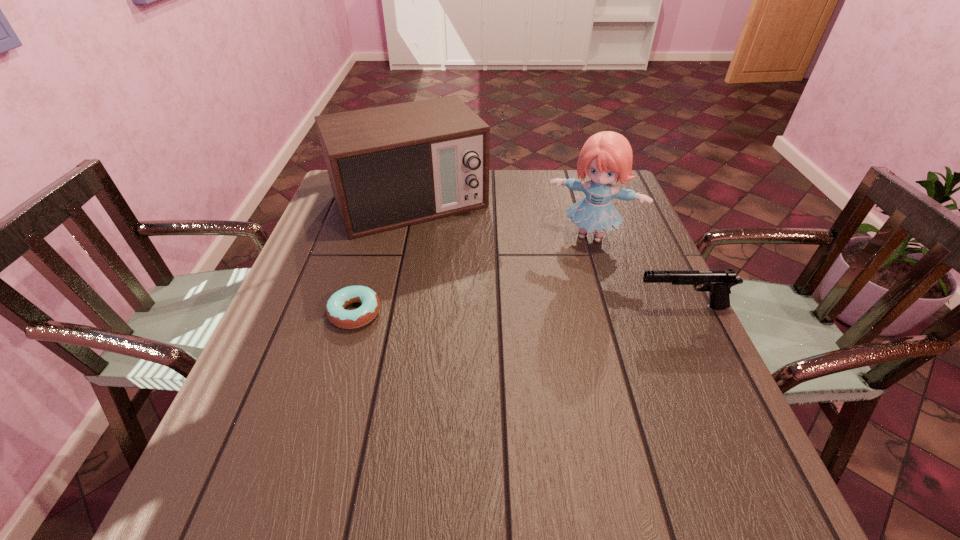
This screenshot has height=540, width=960. In order to click on vacant space at the near edge in this screenshot , I will do `click(589, 409)`.

The width and height of the screenshot is (960, 540). In the image, there is a desktop. Identify the location of free space at the left edge. (333, 275).

In the image, there is a desktop. Identify the location of blank space at the right edge. The width and height of the screenshot is (960, 540). (651, 297).

Identify the location of vacant space at the near right corner of the desktop. The height and width of the screenshot is (540, 960). (684, 421).

Where is `free space that is in between the tallest object and the shortest object`? The image size is (960, 540). free space that is in between the tallest object and the shortest object is located at coordinates (473, 274).

Locate an element on the screen. unoccupied position between the doughnut and the gun is located at coordinates (518, 310).

Find the location of `free area in between the shortest object and the tallest object`. free area in between the shortest object and the tallest object is located at coordinates (473, 274).

Where is `empty space that is in between the tallest object and the third shortest object`? This screenshot has width=960, height=540. empty space that is in between the tallest object and the third shortest object is located at coordinates (500, 219).

Identify the location of free space between the doughnut and the doll. (473, 274).

This screenshot has height=540, width=960. I want to click on empty location between the third shortest object and the doughnut, so click(x=382, y=257).